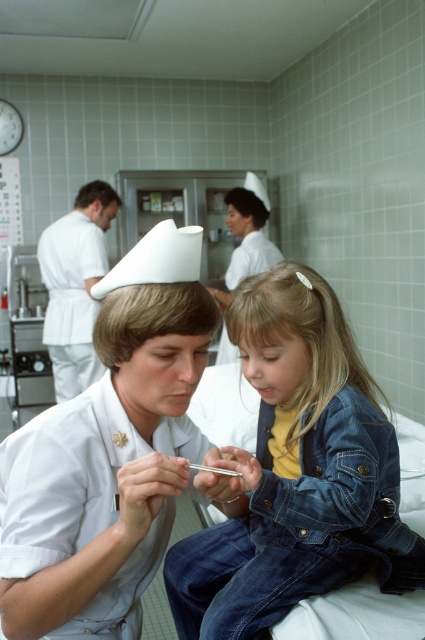
Does denim jacket at lower right have a lesser width compared to faded denim jacket at lower right?

Yes.

Who is more forward, (155,394) or (376,547)?

Positioned in front is point (155,394).

Does point (152, 321) come closer to viewer compared to point (269, 525)?

Yes, it is in front of point (269, 525).

The width and height of the screenshot is (425, 640). I want to click on denim jacket at lower right, so click(x=110, y=454).

The image size is (425, 640). I want to click on faded denim jacket at lower right, so click(x=297, y=472).

Identify the location of faded denim jacket at lower right. The height and width of the screenshot is (640, 425). (297, 472).

Identify the location of denim jacket at lower right. tap(110, 454).

Is denim jacket at lower right wider than white uniform at center?

In fact, denim jacket at lower right might be narrower than white uniform at center.

Locate an element on the screen. Image resolution: width=425 pixels, height=640 pixels. denim jacket at lower right is located at coordinates (110, 454).